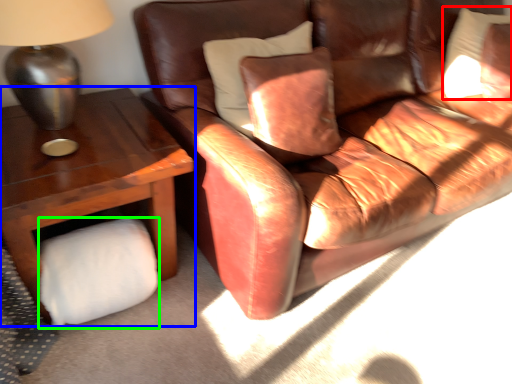
Question: Which object is the farthest from pillow (highlighted by a red box)? Choose among these: table (highlighted by a blue box) or toilet paper (highlighted by a green box).

Choices:
 (A) table
 (B) toilet paper

Answer: (B)